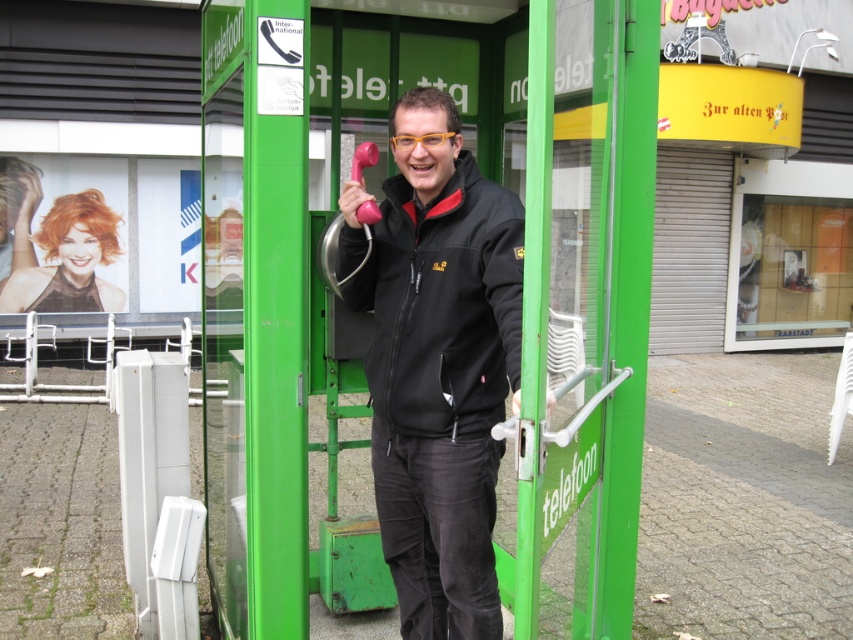
You are a tailor trying to fit a customer for a jacket. The customer is currently wearing a black matte jacket at center and a black softshell jacket at center. The tailor needs to determine which jacket is longer to decide which one requires more fabric for alterations. Based on the image, which jacket is taller?

The black matte jacket at center is taller than the black softshell jacket at center, so it requires more fabric for alterations.

You are trying to determine which jacket is nearer to you in the image of the person inside the telephone booth. Both the black matte jacket at center and the black softshell jacket at center are visible. Which one is closer?

The black matte jacket at center is closer to the viewer than the black softshell jacket at center.

Consider the image. You are trying to decide between two jackets displayed in the image. The black matte jacket at center and the black softshell jacket at center. Which one is narrower?

The black matte jacket at center is narrower than the black softshell jacket at center.